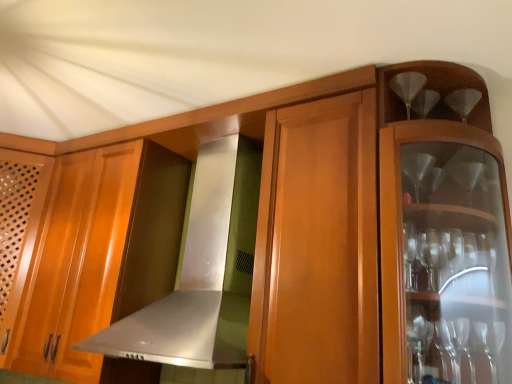
Question: Is wooden cabinet at left further to camera compared to satin silver exhaust hood at center?

Choices:
 (A) no
 (B) yes

Answer: (B)

Question: Is wooden cabinet at left not close to satin silver exhaust hood at center?

Choices:
 (A) no
 (B) yes

Answer: (A)

Question: Can you confirm if wooden cabinet at left is smaller than satin silver exhaust hood at center?

Choices:
 (A) yes
 (B) no

Answer: (B)

Question: Considering the relative sizes of wooden cabinet at left and satin silver exhaust hood at center in the image provided, is wooden cabinet at left bigger than satin silver exhaust hood at center?

Choices:
 (A) yes
 (B) no

Answer: (A)

Question: Is the position of wooden cabinet at left less distant than that of satin silver exhaust hood at center?

Choices:
 (A) yes
 (B) no

Answer: (B)

Question: Considering the relative sizes of wooden cabinet at left and satin silver exhaust hood at center in the image provided, is wooden cabinet at left taller than satin silver exhaust hood at center?

Choices:
 (A) no
 (B) yes

Answer: (B)

Question: Is the position of satin silver exhaust hood at center more distant than that of wooden cabinet at left?

Choices:
 (A) no
 (B) yes

Answer: (A)

Question: Considering the relative positions of satin silver exhaust hood at center and wooden cabinet at left in the image provided, is satin silver exhaust hood at center to the left of wooden cabinet at left from the viewer's perspective?

Choices:
 (A) yes
 (B) no

Answer: (B)

Question: Can you confirm if satin silver exhaust hood at center is smaller than wooden cabinet at left?

Choices:
 (A) yes
 (B) no

Answer: (A)

Question: Is satin silver exhaust hood at center far from wooden cabinet at left?

Choices:
 (A) no
 (B) yes

Answer: (A)

Question: From the image's perspective, does satin silver exhaust hood at center appear higher than wooden cabinet at left?

Choices:
 (A) yes
 (B) no

Answer: (A)

Question: Is satin silver exhaust hood at center wider than wooden cabinet at left?

Choices:
 (A) no
 (B) yes

Answer: (A)

Question: Does satin silver exhaust hood at center have a smaller size compared to clear glass wine glass at upper right?

Choices:
 (A) yes
 (B) no

Answer: (B)